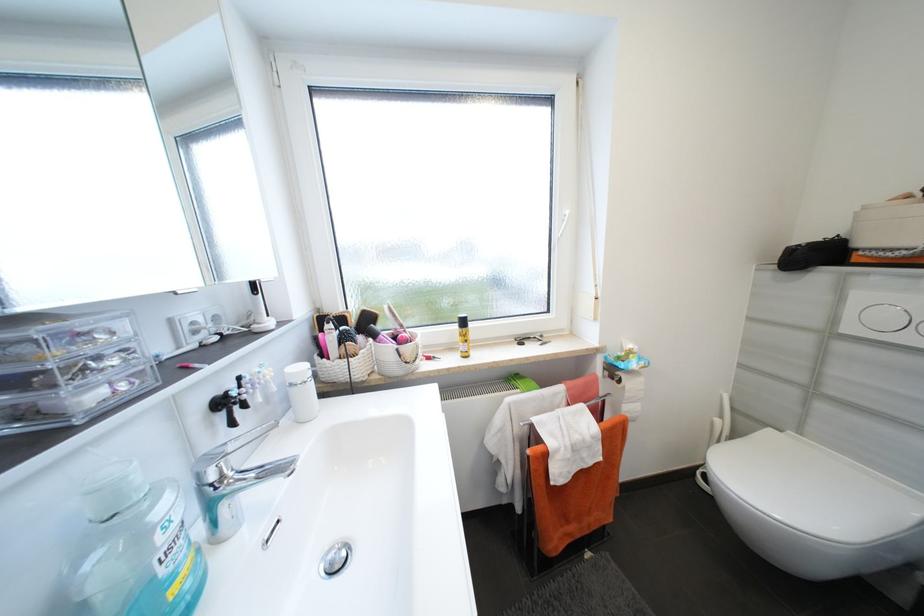
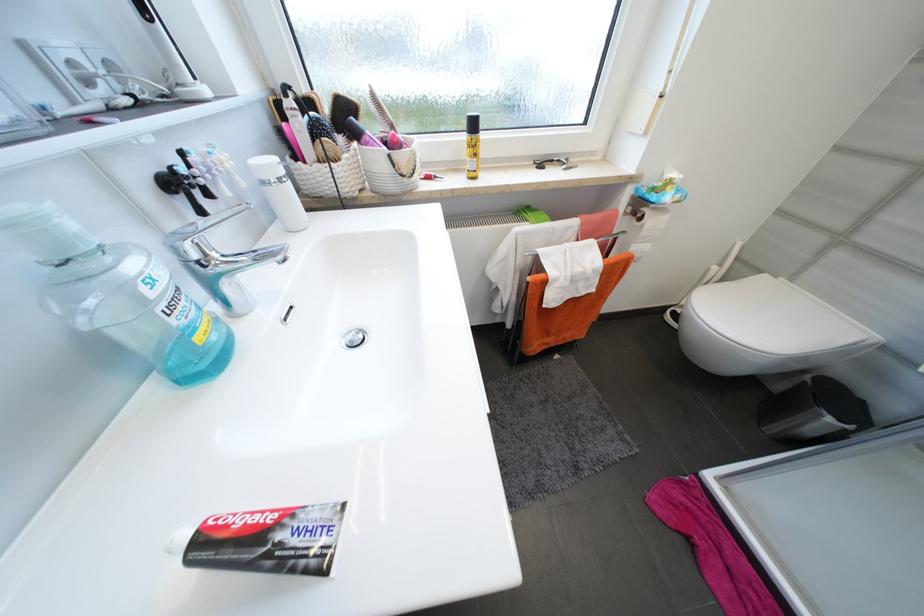
Where in the second image is the point corresponding to point (330, 357) from the first image?

(304, 158)